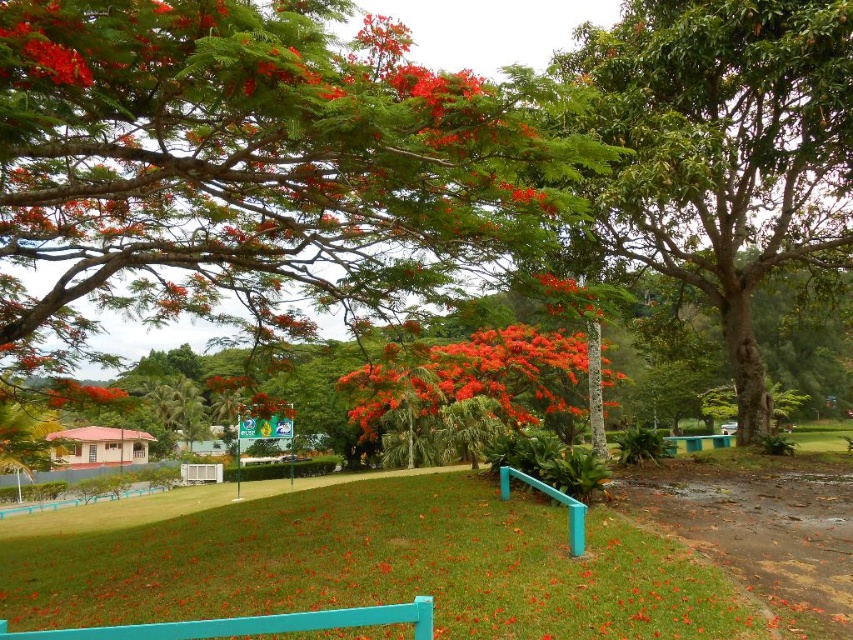
You are a gardener who wants to plant a new flower bed in the center of the lawn. You have two options from the image, the bright orange flower at center and the bright red petals at center. Which one takes up more space and should be considered for spacing requirements?

The bright red petals at center occupy more space than the bright orange flower at center, so they should be considered for spacing requirements.

Based on the photo, you are a gardener who wants to plant a new flower that needs to be placed between the bright orange flower at center and the bright red petals at center. Based on their heights, which one should you place the new flower closer to?

The bright orange flower at center is shorter than the bright red petals at center, so you should place the new flower closer to the bright orange flower at center to ensure proper sunlight and space.